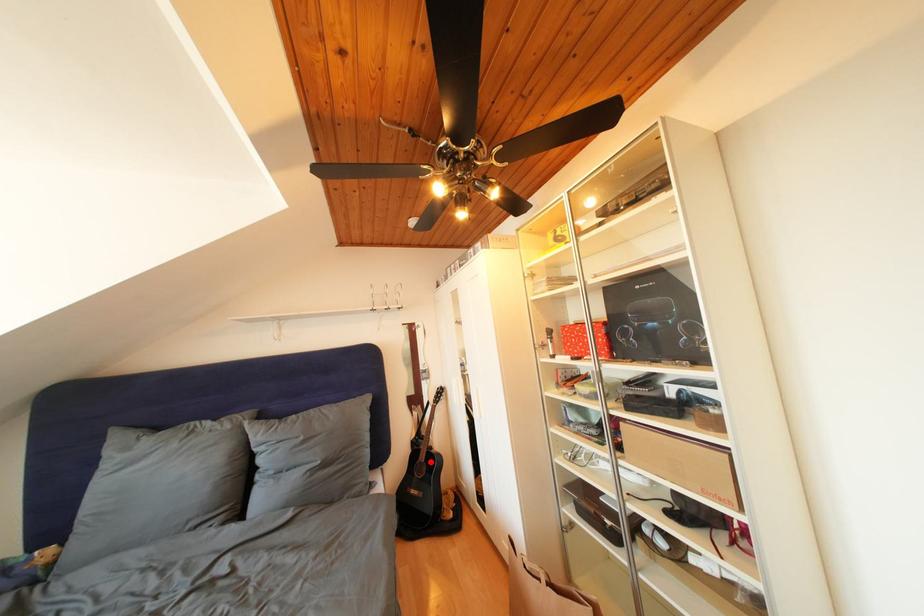
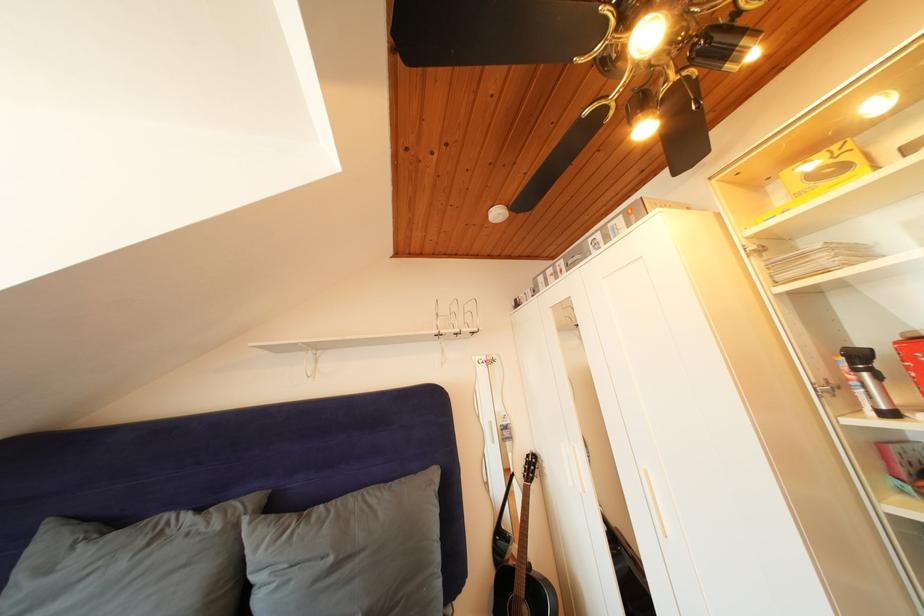
Find the pixel in the second image that matches the highlighted location in the first image.

(528, 592)